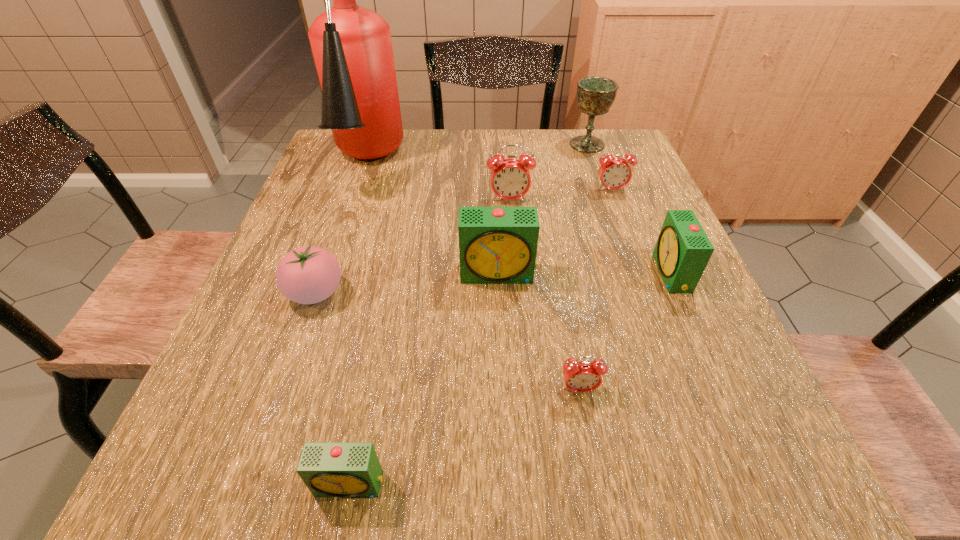
This screenshot has width=960, height=540. In order to click on object that is positioned at the far left corner in this screenshot , I will do `click(352, 48)`.

The height and width of the screenshot is (540, 960). Find the location of `object at the far right corner`. object at the far right corner is located at coordinates (595, 95).

The width and height of the screenshot is (960, 540). What are the coordinates of `free space at the far edge of the desktop` in the screenshot? It's located at (429, 148).

In the image, there is a desktop. Find the location of `vacant space at the left edge`. vacant space at the left edge is located at coordinates (315, 212).

Find the location of `vacant space at the right edge`. vacant space at the right edge is located at coordinates (607, 236).

Find the location of `vacant space at the far left corner of the desktop`. vacant space at the far left corner of the desktop is located at coordinates (339, 169).

Identify the location of vacant position at the near right corner of the desktop. (735, 482).

At what (x,y) coordinates should I click in order to perform the action: click on free spot between the second green alarm clock from left to right and the smallest red alarm clock. Please return your answer as a coordinate pair (x, y). Image resolution: width=960 pixels, height=540 pixels. Looking at the image, I should click on (539, 332).

In order to click on vacant space that is in between the leftmost alarm clock and the rightmost green alarm clock in this screenshot , I will do `click(511, 379)`.

You are a GUI agent. You are given a task and a screenshot of the screen. Output one action in this format:
    pyautogui.click(x=<x>, y=<y>)
    Task: Click on the blank region between the red fire extinguisher and the rightmost red alarm clock
    
    Given the screenshot: What is the action you would take?
    pyautogui.click(x=489, y=177)